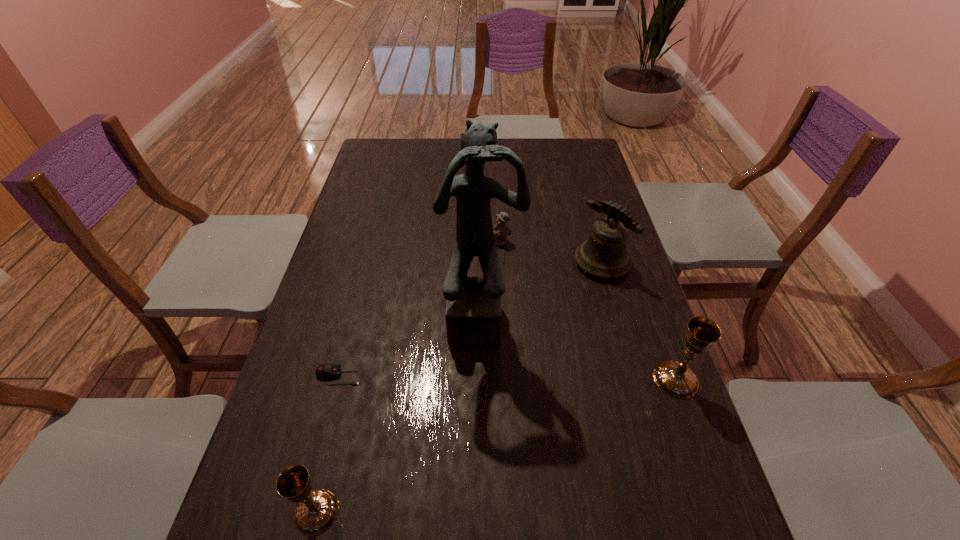
Locate an element on the screen. Image resolution: width=960 pixels, height=540 pixels. unoccupied area between the bell and the teddy bear is located at coordinates (552, 252).

In order to click on vacant space that is in between the farther chalice and the left chalice in this screenshot , I will do `click(496, 446)`.

This screenshot has height=540, width=960. What are the coordinates of `empty location between the farther chalice and the shortest object` in the screenshot? It's located at (507, 378).

You are a GUI agent. You are given a task and a screenshot of the screen. Output one action in this format:
    pyautogui.click(x=<x>, y=<y>)
    Task: Click on the vacant region between the sculpture and the bell
    This screenshot has height=540, width=960.
    Given the screenshot: What is the action you would take?
    pyautogui.click(x=541, y=289)

Identify the location of unoccupied area between the taller chalice and the sculpture. (579, 348).

What are the coordinates of `the fifth closest object to the farther chalice` in the screenshot? It's located at (316, 511).

Identify the location of object that is the fifth closest to the bell. (316, 511).

The height and width of the screenshot is (540, 960). Identify the location of vacant point that satisfies the following two spatial constraints: 1. on the face of the tallest object; 2. on the left side of the taller chalice. (482, 380).

The image size is (960, 540). Find the location of `free space that satisfies the following two spatial constraints: 1. on the front-facing side of the farther chalice; 2. on the right side of the second shortest object`. free space that satisfies the following two spatial constraints: 1. on the front-facing side of the farther chalice; 2. on the right side of the second shortest object is located at coordinates (509, 380).

This screenshot has height=540, width=960. What are the coordinates of `free location that satisfies the following two spatial constraints: 1. on the front-facing side of the fifth tallest object; 2. on the left side of the farther chalice` in the screenshot? It's located at (509, 380).